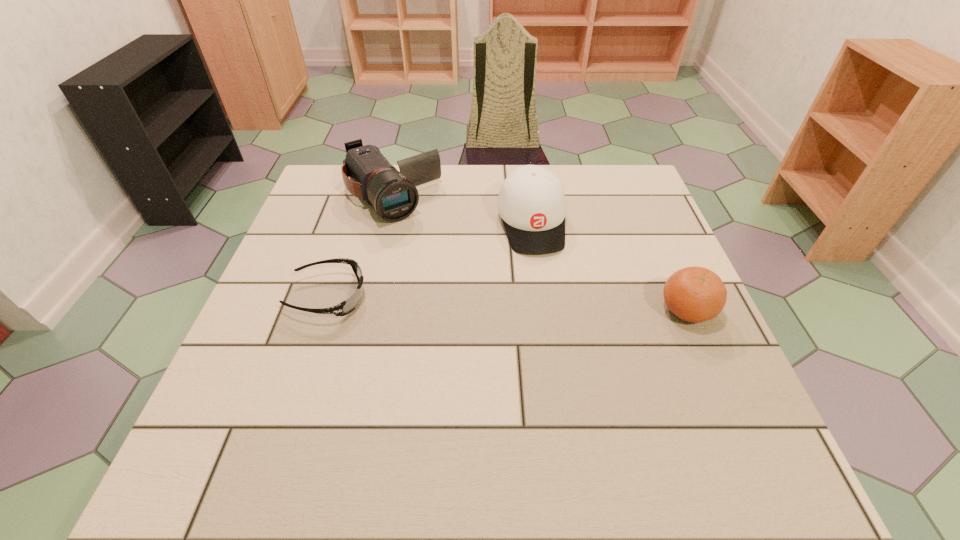
Find the location of a particular element. This screenshot has height=540, width=960. free spot between the baseball cap and the rightmost object is located at coordinates (609, 267).

Locate an element on the screen. This screenshot has width=960, height=540. empty space that is in between the baseball cap and the rightmost object is located at coordinates (609, 267).

Identify the location of the second closest object relative to the baseball cap. (694, 294).

This screenshot has width=960, height=540. In order to click on object that is the closest to the baseball cap in this screenshot , I will do `click(394, 195)`.